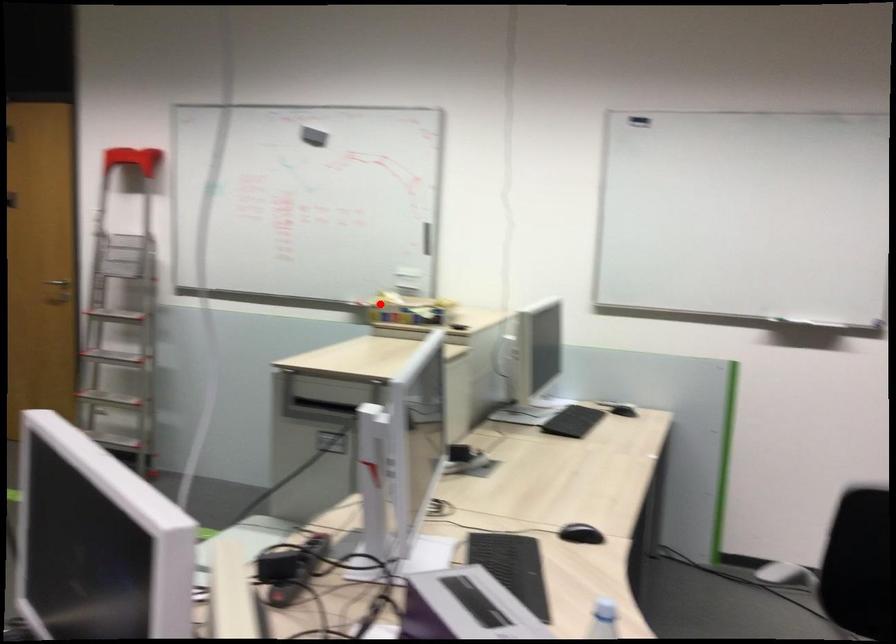
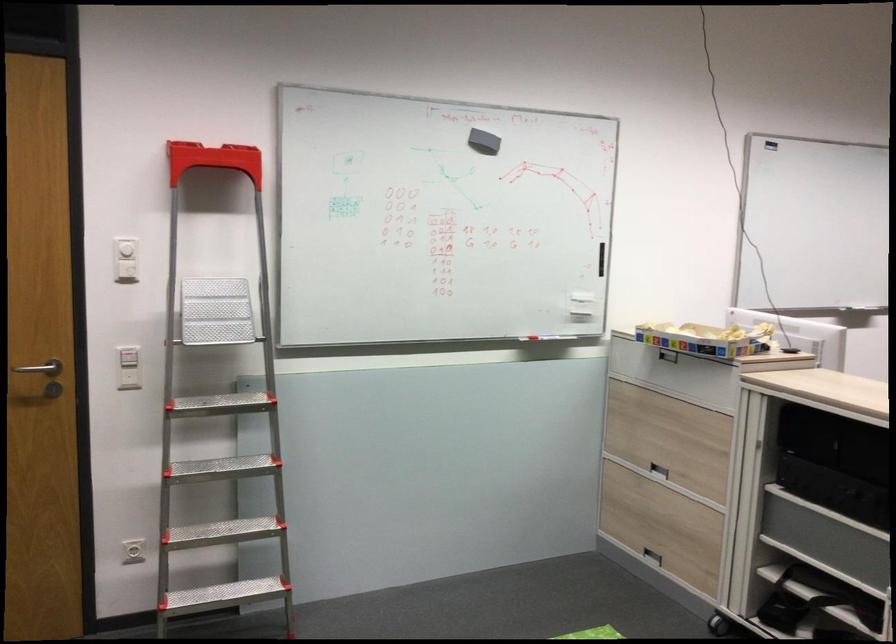
The point at the highlighted location is marked in the first image. Where is the corresponding point in the second image?

(705, 339)